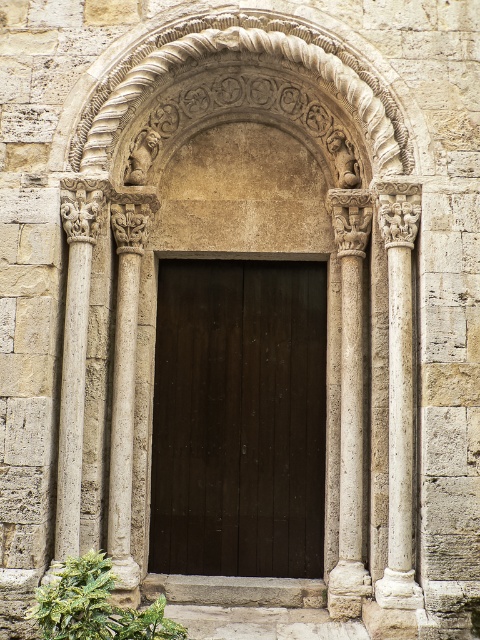
Is dark wood door at center positioned behind smooth stone column at left?

That is True.

Does dark wood door at center have a greater width compared to smooth stone column at left?

Yes.

The image size is (480, 640). Describe the element at coordinates (239, 419) in the screenshot. I see `dark wood door at center` at that location.

At what (x,y) coordinates should I click in order to perform the action: click on dark wood door at center. Please return your answer as a coordinate pair (x, y). Looking at the image, I should click on (239, 419).

Which of these two, carved stone arch at center or white stone column at right, stands shorter?

white stone column at right

Consider the image. Who is more distant from viewer, [187,29] or [393,388]?

Point [187,29]

What do you see at coordinates (251, 52) in the screenshot?
I see `carved stone arch at center` at bounding box center [251, 52].

Where is `carved stone arch at center`? This screenshot has height=640, width=480. carved stone arch at center is located at coordinates (251, 52).

Can you confirm if dark wood door at center is positioned below white stone column at right?

No.

The image size is (480, 640). What do you see at coordinates (239, 419) in the screenshot? I see `dark wood door at center` at bounding box center [239, 419].

Where is `dark wood door at center`? dark wood door at center is located at coordinates (239, 419).